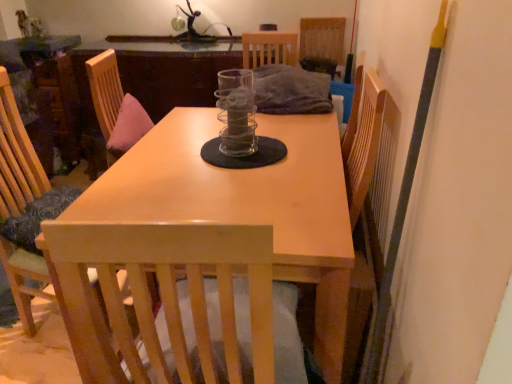
Where is `vacant region under metallic glass sculpture at upper center (from a real-world perspective)`? The image size is (512, 384). vacant region under metallic glass sculpture at upper center (from a real-world perspective) is located at coordinates (199, 43).